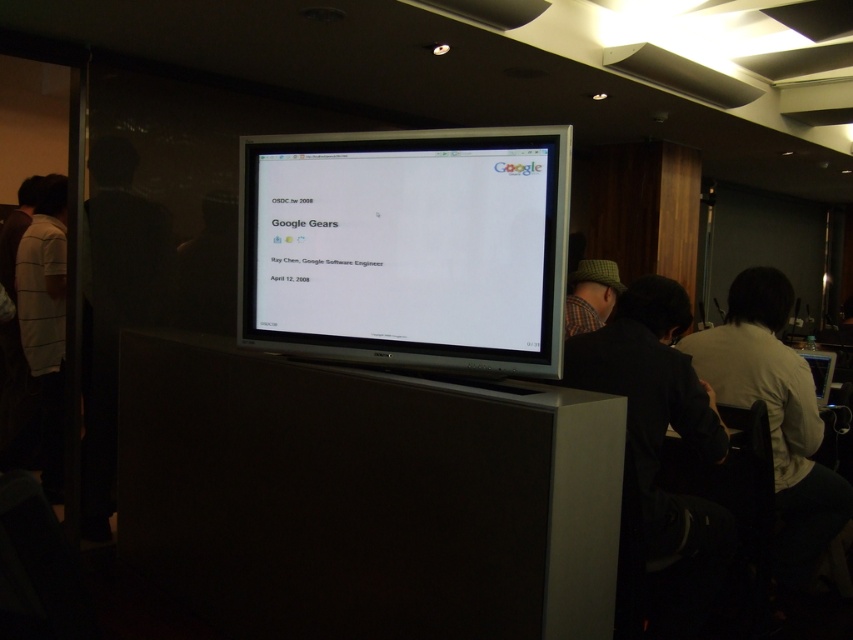
Question: Can you confirm if matte black monitor at center is thinner than green plaid hat at center?

Choices:
 (A) no
 (B) yes

Answer: (A)

Question: Which object is closer to the camera taking this photo?

Choices:
 (A) green plaid hat at center
 (B) matte black monitor at center

Answer: (B)

Question: Which point is closer to the camera?

Choices:
 (A) matte black monitor at center
 (B) green plaid hat at center

Answer: (A)

Question: Which object is farther from the camera taking this photo?

Choices:
 (A) green plaid hat at center
 (B) matte black monitor at center

Answer: (A)

Question: Is matte black monitor at center to the right of green plaid hat at center from the viewer's perspective?

Choices:
 (A) yes
 (B) no

Answer: (B)

Question: Is matte black monitor at center to the right of green plaid hat at center from the viewer's perspective?

Choices:
 (A) no
 (B) yes

Answer: (A)